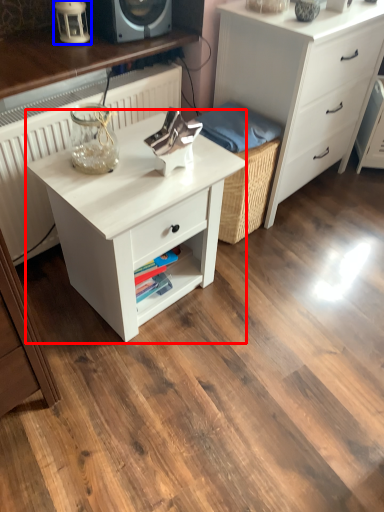
Question: Which object appears farthest to the camera in this image, nightstand (highlighted by a red box) or table lamp (highlighted by a blue box)?

Choices:
 (A) nightstand
 (B) table lamp

Answer: (B)